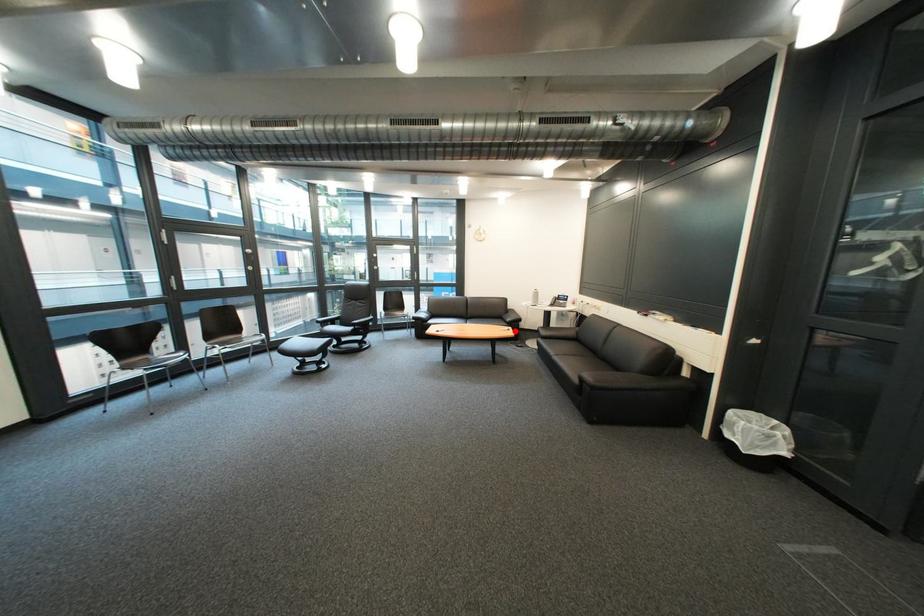
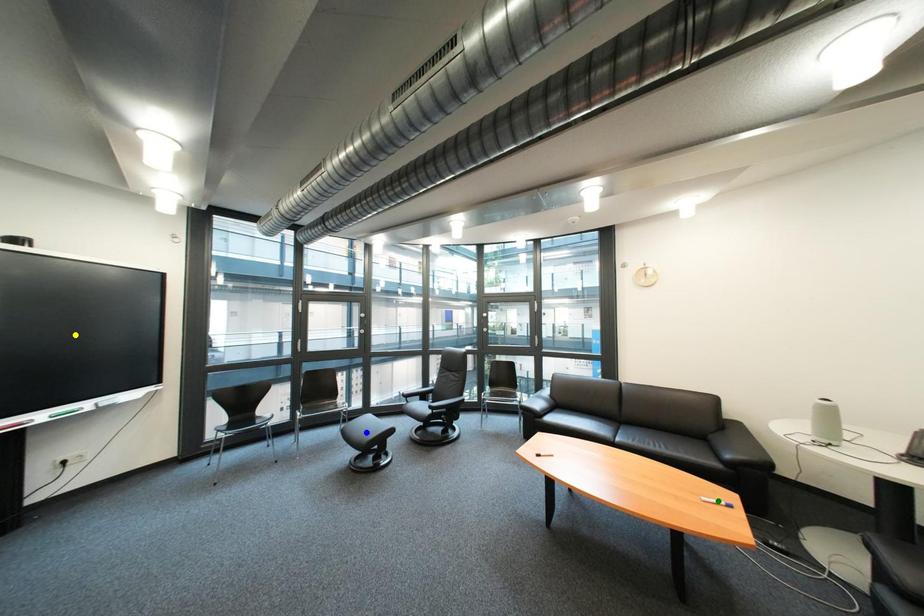
Question: I am providing you with two images of the same scene from different viewpoints. A red point is marked on the first image. You are given multiple points on the second image. Which spot in image 2 lines up with the point in image 1?

Choices:
 (A) blue point
 (B) green point
 (C) yellow point

Answer: (B)